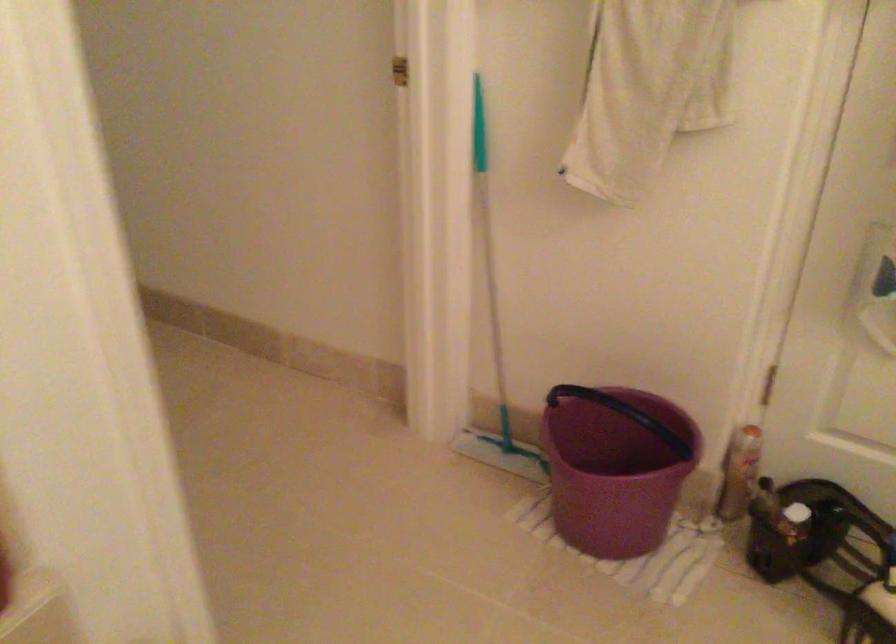
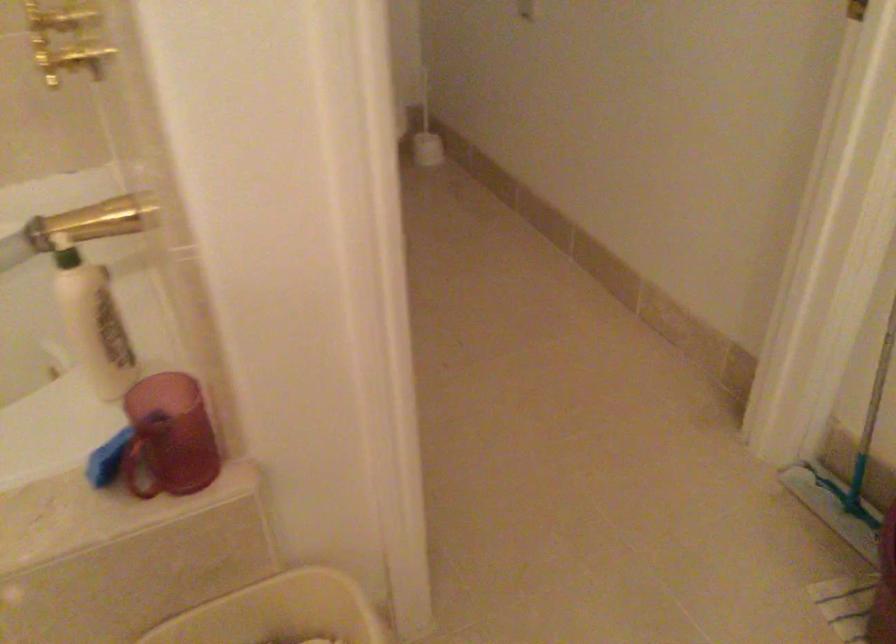
Question: The first image is from the beginning of the video and the second image is from the end. How did the camera likely rotate when shooting the video?

Choices:
 (A) Left
 (B) Right
 (C) Up
 (D) Down

Answer: (A)